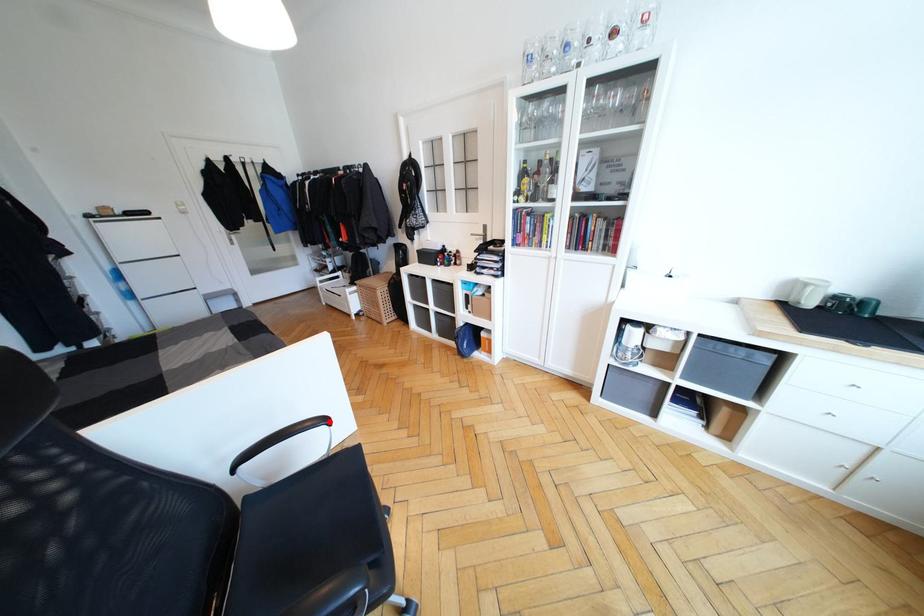
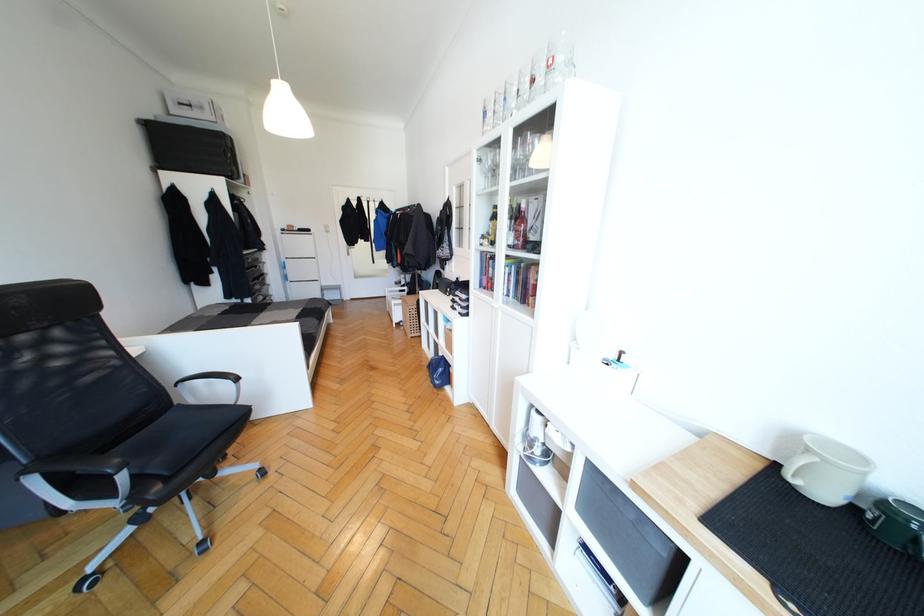
Where in the second image is the point corresponding to the highlighted location from the first image?

(239, 379)